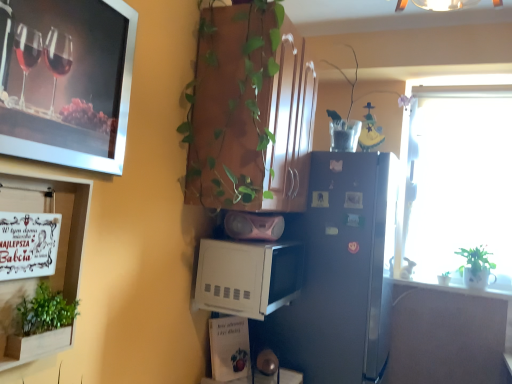
Question: Is white glossy counter top at right situated inside green leafy plant at lower left, which is counted as the second houseplant, starting from the top, or outside?

Choices:
 (A) inside
 (B) outside

Answer: (B)

Question: Relative to green leafy plant at lower left, which appears as the 1th houseplant when viewed from the front, is white glossy counter top at right in front or behind?

Choices:
 (A) behind
 (B) front

Answer: (A)

Question: Estimate the real-world distances between objects in this image. Which object is farther from the green leafy plant at lower left, the first houseplant viewed from the left?

Choices:
 (A) white matte microwave at center, which is the second appliance from top to bottom
 (B) green matte plant at right, which is the 3th houseplant in front-to-back order
 (C) white glossy counter top at right
 (D) pink matte speaker at center, placed as the 1th appliance when sorted from top to bottom
 (E) translucent plastic vase at upper center, the second houseplant positioned from the back

Answer: (B)

Question: Which object is positioned farthest from the white glossy counter top at right?

Choices:
 (A) satin silver refrigerator at center
 (B) white matte microwave at center, which is the second appliance from top to bottom
 (C) green leafy plant at lower left, which is counted as the second houseplant, starting from the top
 (D) green matte plant at right, which ranks as the 3th houseplant in left-to-right order
 (E) wooden signboard at left

Answer: (E)